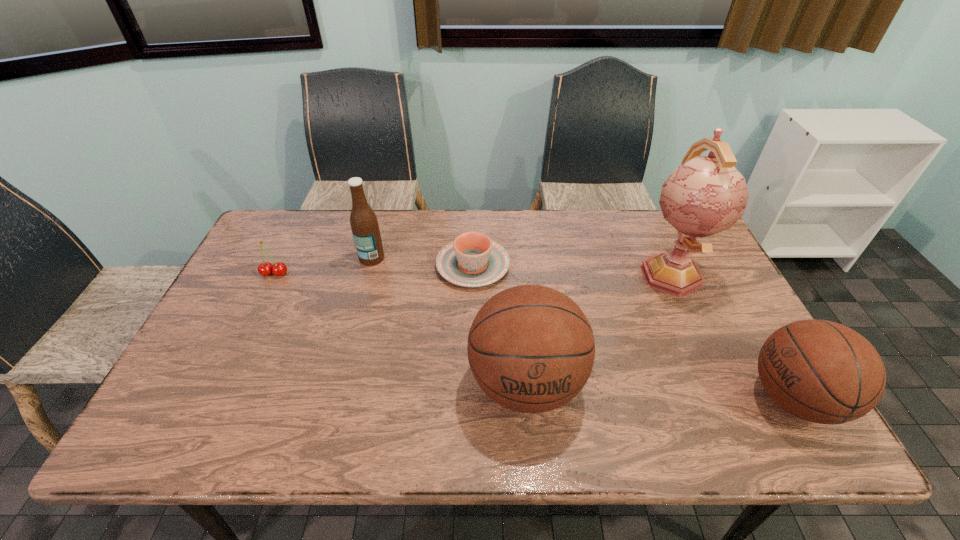
Locate an element on the screen. Image resolution: width=960 pixels, height=540 pixels. the taller basketball is located at coordinates pyautogui.click(x=531, y=349).

The height and width of the screenshot is (540, 960). Identify the location of the shorter basketball. (820, 371).

What are the coordinates of `the right basketball` in the screenshot? It's located at (820, 371).

Locate an element on the screen. The width and height of the screenshot is (960, 540). the shortest object is located at coordinates (472, 260).

The image size is (960, 540). Find the location of `the tallest object`. the tallest object is located at coordinates (705, 195).

Locate an element on the screen. The image size is (960, 540). beer bottle is located at coordinates (364, 224).

Where is `cherry`? cherry is located at coordinates (279, 269).

Where is `the leftmost object`? the leftmost object is located at coordinates (279, 269).

Identify the location of blank space located on the side with brand label of the shorter basketball. Image resolution: width=960 pixels, height=540 pixels. (613, 398).

I want to click on vacant point located 0.140m on the side with brand label of the shorter basketball, so [686, 398].